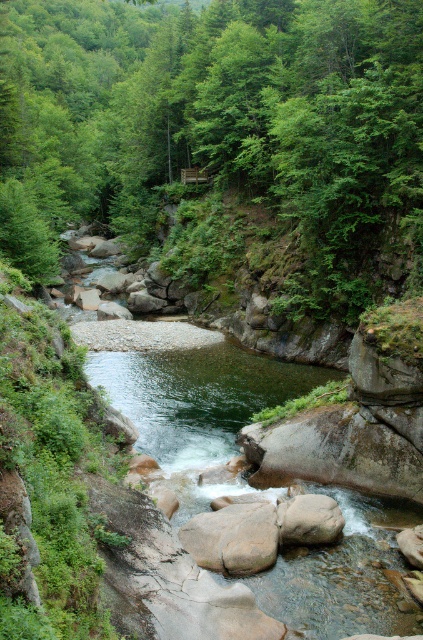
You are planning to set up a picnic blanket. You have two options for placement near the green leafy tree at center and the brown rough boulder at center. Which location would provide more space around it for the blanket?

The green leafy tree at center might be wider than the brown rough boulder at center, so placing the picnic blanket near the green leafy tree at center could offer more space around it.

You are a hiker trying to cross the river using the rocks. The smooth gray rock at center is 30 cm wide. Can you step on the brown rough boulder at center without falling into the water?

The brown rough boulder at center is wider than the smooth gray rock at center, which is 30 cm wide. Therefore, the brown rough boulder at center is wider than 30 cm, so it should be safe to step on it without falling into the water.